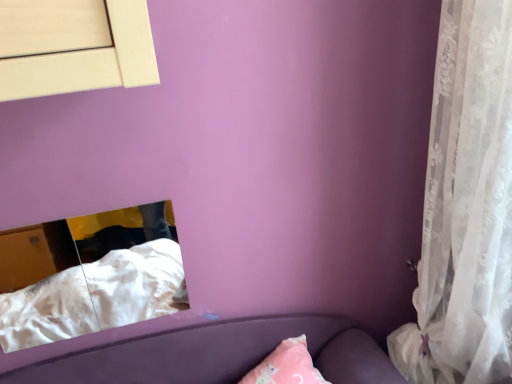
This screenshot has width=512, height=384. Find the location of `white soft fabric at lower left`. white soft fabric at lower left is located at coordinates [x=94, y=296].

What do you see at coordinates (94, 296) in the screenshot?
I see `white soft fabric at lower left` at bounding box center [94, 296].

I want to click on white lace curtain at right, so click(466, 207).

Measure the distance between point (441, 240) and camera.

They are 36.65 inches apart.

This screenshot has height=384, width=512. Describe the element at coordinates (466, 207) in the screenshot. I see `white lace curtain at right` at that location.

Where is `white soft fabric at lower left`? This screenshot has width=512, height=384. white soft fabric at lower left is located at coordinates (94, 296).

Based on their positions, is white soft fabric at lower left located to the left or right of white lace curtain at right?

white soft fabric at lower left is to the left of white lace curtain at right.

Which object is further away from the camera, white soft fabric at lower left or white lace curtain at right?

white soft fabric at lower left is behind.

Is point (161, 265) behind point (471, 313)?

Yes, point (161, 265) is behind point (471, 313).

From the image's perspective, relative to white lace curtain at right, is white soft fabric at lower left above or below?

Clearly, from the image's perspective, white soft fabric at lower left is below white lace curtain at right.

From a real-world perspective, who is located higher, white soft fabric at lower left or white lace curtain at right?

In real-world perspective, white lace curtain at right is above.

Considering the relative sizes of white soft fabric at lower left and white lace curtain at right in the image provided, is white soft fabric at lower left wider than white lace curtain at right?

Incorrect, the width of white soft fabric at lower left does not surpass that of white lace curtain at right.

Is white soft fabric at lower left shorter than white lace curtain at right?

Yes.

Consider the image. Based on their sizes in the image, would you say white soft fabric at lower left is bigger or smaller than white lace curtain at right?

In the image, white soft fabric at lower left appears to be smaller than white lace curtain at right.

Looking at this image, is white soft fabric at lower left inside the boundaries of white lace curtain at right, or outside?

The correct answer is: outside.

From the picture: Is the surface of white soft fabric at lower left in direct contact with white lace curtain at right?

white soft fabric at lower left is not next to white lace curtain at right, and they're not touching.

Could you tell me if white soft fabric at lower left is turned towards white lace curtain at right?

No, white soft fabric at lower left does not turn towards white lace curtain at right.

How different are the orientations of white soft fabric at lower left and white lace curtain at right in degrees?

89.2 degrees separate the facing orientations of white soft fabric at lower left and white lace curtain at right.

How much distance is there between white soft fabric at lower left and white lace curtain at right?

white soft fabric at lower left is 3.38 feet away from white lace curtain at right.

Locate an element on the screen. curtain above the white soft fabric at lower left (from the image's perspective) is located at coordinates (466, 207).

Considering the relative positions of white lace curtain at right and white soft fabric at lower left in the image provided, is white lace curtain at right to the right of white soft fabric at lower left from the viewer's perspective?

Indeed, white lace curtain at right is positioned on the right side of white soft fabric at lower left.

In the image, is white lace curtain at right positioned in front of or behind white soft fabric at lower left?

white lace curtain at right is positioned closer to the viewer than white soft fabric at lower left.

Considering the points (448, 39) and (16, 332), which point is behind, point (448, 39) or point (16, 332)?

Positioned behind is point (16, 332).

From the image's perspective, is white lace curtain at right below white soft fabric at lower left?

No.

From a real-world perspective, is white lace curtain at right beneath white soft fabric at lower left?

No.

Does white lace curtain at right have a greater width compared to white soft fabric at lower left?

Indeed, white lace curtain at right has a greater width compared to white soft fabric at lower left.

Can you confirm if white lace curtain at right is taller than white soft fabric at lower left?

Yes, white lace curtain at right is taller than white soft fabric at lower left.

From the picture: Does white lace curtain at right have a larger size compared to white soft fabric at lower left?

Indeed, white lace curtain at right has a larger size compared to white soft fabric at lower left.

Is white lace curtain at right inside or outside of white soft fabric at lower left?

white lace curtain at right exists outside the volume of white soft fabric at lower left.

Are white lace curtain at right and white soft fabric at lower left far apart?

Indeed, white lace curtain at right is not near white soft fabric at lower left.

Is white lace curtain at right positioned with its back to white soft fabric at lower left?

white lace curtain at right does not have its back to white soft fabric at lower left.

How different are the orientations of white lace curtain at right and white soft fabric at lower left in degrees?

The facing directions of white lace curtain at right and white soft fabric at lower left are 89.2 degrees apart.

Locate an element on the screen. This screenshot has height=384, width=512. curtain above the white soft fabric at lower left (from the image's perspective) is located at coordinates (466, 207).

The width and height of the screenshot is (512, 384). Identify the location of sheet behind the white lace curtain at right. (94, 296).

Where is `curtain on the right side of white soft fabric at lower left`? The width and height of the screenshot is (512, 384). curtain on the right side of white soft fabric at lower left is located at coordinates (466, 207).